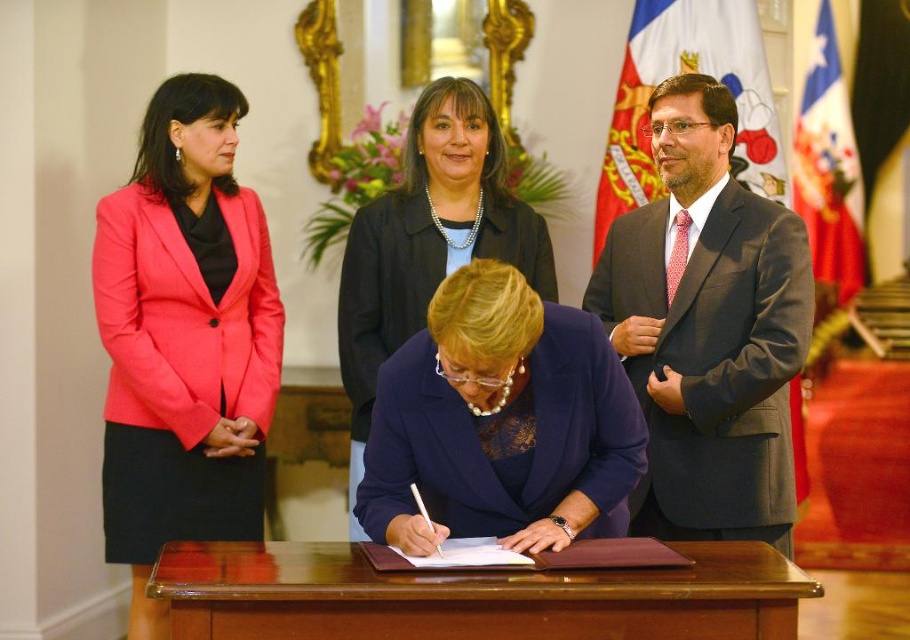
Which of these two, matte pink blazer at left or matte black blazer at center, stands shorter?

Standing shorter between the two is matte black blazer at center.

Does matte pink blazer at left lie in front of matte black blazer at center?

Yes, it is in front of matte black blazer at center.

Does point (142, 244) lie behind point (366, 321)?

No, (142, 244) is in front of (366, 321).

This screenshot has width=910, height=640. In order to click on matte pink blazer at left in this screenshot , I will do `click(184, 339)`.

Between navy blue fabric at center and brown polished wood table at center, which one has less height?

brown polished wood table at center is shorter.

Does navy blue fabric at center have a lesser height compared to brown polished wood table at center?

No, navy blue fabric at center is not shorter than brown polished wood table at center.

You are a GUI agent. You are given a task and a screenshot of the screen. Output one action in this format:
    pyautogui.click(x=<x>, y=<y>)
    Task: Click on the navy blue fabric at center
    This screenshot has height=640, width=910.
    Given the screenshot: What is the action you would take?
    pyautogui.click(x=500, y=422)

Is matte pink blazer at left to the right of brown polished wood table at center from the viewer's perspective?

No, matte pink blazer at left is not to the right of brown polished wood table at center.

In order to click on matte pink blazer at left in this screenshot , I will do `click(184, 339)`.

This screenshot has height=640, width=910. I want to click on matte pink blazer at left, so click(x=184, y=339).